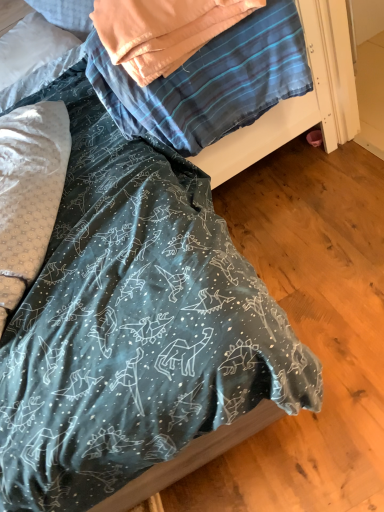
In order to click on teal fabric at center in this screenshot , I will do `click(210, 82)`.

Is the position of teal fabric at center less distant than that of white soft pillow at upper left, which is the 2th pillow in bottom-to-top order?

That is True.

Can you tell me how much teal fabric at center and white soft pillow at upper left, the 1th pillow in the back-to-front sequence, differ in facing direction?

The angle between the facing direction of teal fabric at center and the facing direction of white soft pillow at upper left, the 1th pillow in the back-to-front sequence, is 3.79 degrees.

From a real-world perspective, which object stands above the other?

From a 3D spatial view, teal fabric at center is above.

From a real-world perspective, which pillow is the 1st one underneath the teal fabric at center? Please provide its 2D coordinates.

[(31, 47)]

Which is closer to the camera, (20, 70) or (244, 36)?

Clearly, point (20, 70) is more distant from the camera than point (244, 36).

Does white soft pillow at upper left, acting as the 1th pillow starting from the top, contain teal fabric at center?

No, teal fabric at center is not surrounded by white soft pillow at upper left, acting as the 1th pillow starting from the top.

Considering the sizes of objects white soft pillow at upper left, the second pillow when ordered from front to back, and teal fabric at center in the image provided, who is shorter, white soft pillow at upper left, the second pillow when ordered from front to back, or teal fabric at center?

white soft pillow at upper left, the second pillow when ordered from front to back, is shorter.

How many degrees apart are the facing directions of white soft pillow at upper left, which is the 2th pillow in bottom-to-top order, and teal fabric at center?

The facing directions of white soft pillow at upper left, which is the 2th pillow in bottom-to-top order, and teal fabric at center are 3.79 degrees apart.

Measure the distance between white soft pillow at upper left, acting as the 1th pillow starting from the top, and white dotted fabric pillow at left, arranged as the 1th pillow when viewed from the front.

white soft pillow at upper left, acting as the 1th pillow starting from the top, and white dotted fabric pillow at left, arranged as the 1th pillow when viewed from the front, are 29.07 inches apart.

Is point (74, 42) closer or farther from the camera than point (38, 177)?

Point (74, 42) is positioned farther from the camera compared to point (38, 177).

Based on the photo, can you confirm if white soft pillow at upper left, acting as the 1th pillow starting from the top, is thinner than white dotted fabric pillow at left, arranged as the 1th pillow when viewed from the front?

Correct, the width of white soft pillow at upper left, acting as the 1th pillow starting from the top, is less than that of white dotted fabric pillow at left, arranged as the 1th pillow when viewed from the front.

Between white dotted fabric pillow at left, which appears as the 1th pillow when ordered from the bottom, and teal fabric at center, which one appears on the left side from the viewer's perspective?

white dotted fabric pillow at left, which appears as the 1th pillow when ordered from the bottom.

At what (x,y) coordinates should I click in order to perform the action: click on blanket above the white dotted fabric pillow at left, which appears as the 1th pillow when ordered from the bottom (from the image's perspective). Please return your answer as a coordinate pair (x, y). The width and height of the screenshot is (384, 512). Looking at the image, I should click on (210, 82).

Between point (19, 262) and point (150, 98), which one is positioned in front?

The point (19, 262) is in front.

How many degrees apart are the facing directions of white dotted fabric pillow at left, which appears as the second pillow when viewed from the back, and white soft pillow at upper left, the second pillow when ordered from front to back?

The facing directions of white dotted fabric pillow at left, which appears as the second pillow when viewed from the back, and white soft pillow at upper left, the second pillow when ordered from front to back, are 29.6 degrees apart.

Which of these two, white dotted fabric pillow at left, which appears as the second pillow when viewed from the back, or white soft pillow at upper left, the second pillow when ordered from front to back, is thinner?

Thinner between the two is white soft pillow at upper left, the second pillow when ordered from front to back.

From the image's perspective, is white dotted fabric pillow at left, arranged as the 1th pillow when viewed from the front, under white soft pillow at upper left, the second pillow when ordered from front to back?

Indeed, from the image's perspective, white dotted fabric pillow at left, arranged as the 1th pillow when viewed from the front, is shown beneath white soft pillow at upper left, the second pillow when ordered from front to back.

From a real-world perspective, is white dotted fabric pillow at left, arranged as the 1th pillow when viewed from the front, positioned above or below white soft pillow at upper left, acting as the 1th pillow starting from the top?

In terms of real-world spatial position, white dotted fabric pillow at left, arranged as the 1th pillow when viewed from the front, is below white soft pillow at upper left, acting as the 1th pillow starting from the top.

Relative to white dotted fabric pillow at left, arranged as the 1th pillow when viewed from the front, is teal fabric at center in front or behind?

Visually, teal fabric at center is located behind white dotted fabric pillow at left, arranged as the 1th pillow when viewed from the front.

From the image's perspective, is teal fabric at center located beneath white dotted fabric pillow at left, arranged as the 1th pillow when viewed from the front?

Incorrect, from the image's perspective, teal fabric at center is higher than white dotted fabric pillow at left, arranged as the 1th pillow when viewed from the front.

Is teal fabric at center next to white dotted fabric pillow at left, which appears as the second pillow when viewed from the back?

No, teal fabric at center is not next to white dotted fabric pillow at left, which appears as the second pillow when viewed from the back.

Is point (288, 79) farther from camera compared to point (4, 261)?

Yes, it is behind point (4, 261).

Where is `blanket below the white soft pillow at upper left, acting as the 1th pillow starting from the top (from the image's perspective)`? This screenshot has width=384, height=512. blanket below the white soft pillow at upper left, acting as the 1th pillow starting from the top (from the image's perspective) is located at coordinates (210, 82).

Where is `pillow that appears above the teal fabric at center (from the image's perspective)`? The image size is (384, 512). pillow that appears above the teal fabric at center (from the image's perspective) is located at coordinates (31, 47).

Considering their positions, is white dotted fabric pillow at left, the second pillow when ordered from top to bottom, positioned closer to white soft pillow at upper left, which is the 2th pillow in bottom-to-top order, than teal fabric at center?

Among the two, white dotted fabric pillow at left, the second pillow when ordered from top to bottom, is located nearer to white soft pillow at upper left, which is the 2th pillow in bottom-to-top order.

When comparing their distances from white dotted fabric pillow at left, arranged as the 1th pillow when viewed from the front, does teal fabric at center or white soft pillow at upper left, the 1th pillow in the back-to-front sequence, seem further?

Based on the image, white soft pillow at upper left, the 1th pillow in the back-to-front sequence, appears to be further to white dotted fabric pillow at left, arranged as the 1th pillow when viewed from the front.

Which object lies further to the anchor point teal fabric at center, white dotted fabric pillow at left, the second pillow when ordered from top to bottom, or white soft pillow at upper left, the 1th pillow in the back-to-front sequence?

white soft pillow at upper left, the 1th pillow in the back-to-front sequence.

Which object lies nearer to the anchor point teal fabric at center, white soft pillow at upper left, acting as the 1th pillow starting from the top, or white dotted fabric pillow at left, the second pillow when ordered from top to bottom?

white dotted fabric pillow at left, the second pillow when ordered from top to bottom, is closer to teal fabric at center.

Based on the photo, when comparing their distances from white dotted fabric pillow at left, the second pillow when ordered from top to bottom, does white soft pillow at upper left, which is the 2th pillow in bottom-to-top order, or teal fabric at center seem further?

white soft pillow at upper left, which is the 2th pillow in bottom-to-top order, is positioned further to the anchor white dotted fabric pillow at left, the second pillow when ordered from top to bottom.

Based on their spatial positions, is teal fabric at center or white dotted fabric pillow at left, the second pillow when ordered from top to bottom, closer to white soft pillow at upper left, acting as the 1th pillow starting from the top?

→ white dotted fabric pillow at left, the second pillow when ordered from top to bottom, is positioned closer to the anchor white soft pillow at upper left, acting as the 1th pillow starting from the top.

You are a GUI agent. You are given a task and a screenshot of the screen. Output one action in this format:
    pyautogui.click(x=<x>, y=<y>)
    Task: Click on the blanket positioned between white dotted fabric pillow at left, arranged as the 1th pillow when viewed from the front, and white soft pillow at upper left, the second pillow when ordered from front to back, from near to far
    The image size is (384, 512).
    Given the screenshot: What is the action you would take?
    pyautogui.click(x=210, y=82)